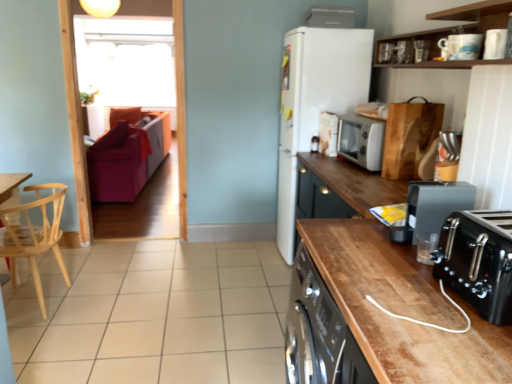
Question: From the image's perspective, does beige tile at lower center appear higher than silver metallic microwave at upper right, which appears as the first kitchen appliance when viewed from the back?

Choices:
 (A) yes
 (B) no

Answer: (B)

Question: Considering the relative sizes of beige tile at lower center and silver metallic microwave at upper right, which appears as the first kitchen appliance when viewed from the back, in the image provided, is beige tile at lower center taller than silver metallic microwave at upper right, which appears as the first kitchen appliance when viewed from the back,?

Choices:
 (A) no
 (B) yes

Answer: (A)

Question: Considering the relative sizes of beige tile at lower center and silver metallic microwave at upper right, which is the third kitchen appliance from front to back, in the image provided, is beige tile at lower center bigger than silver metallic microwave at upper right, which is the third kitchen appliance from front to back,?

Choices:
 (A) no
 (B) yes

Answer: (B)

Question: Could silver metallic microwave at upper right, which appears as the first kitchen appliance when viewed from the back, be considered to be inside beige tile at lower center?

Choices:
 (A) no
 (B) yes

Answer: (A)

Question: Is beige tile at lower center far away from silver metallic microwave at upper right, which is the third kitchen appliance from front to back?

Choices:
 (A) no
 (B) yes

Answer: (B)

Question: From a real-world perspective, is beige tile at lower center over silver metallic microwave at upper right, placed as the 3th kitchen appliance when sorted from bottom to top?

Choices:
 (A) no
 (B) yes

Answer: (A)

Question: Is the depth of transparent glass window screen at upper left greater than that of white matte refrigerator at center?

Choices:
 (A) yes
 (B) no

Answer: (A)

Question: Is transparent glass window screen at upper left looking in the opposite direction of white matte refrigerator at center?

Choices:
 (A) yes
 (B) no

Answer: (B)

Question: From the image's perspective, would you say transparent glass window screen at upper left is positioned over white matte refrigerator at center?

Choices:
 (A) yes
 (B) no

Answer: (A)

Question: Can you confirm if transparent glass window screen at upper left is positioned to the left of white matte refrigerator at center?

Choices:
 (A) no
 (B) yes

Answer: (B)

Question: Does transparent glass window screen at upper left lie in front of white matte refrigerator at center?

Choices:
 (A) yes
 (B) no

Answer: (B)

Question: Does transparent glass window screen at upper left contain white matte refrigerator at center?

Choices:
 (A) yes
 (B) no

Answer: (B)

Question: Is white glossy microwave at upper right, which is the 6th appliance from top to bottom, smaller than light wood chair at left?

Choices:
 (A) yes
 (B) no

Answer: (A)